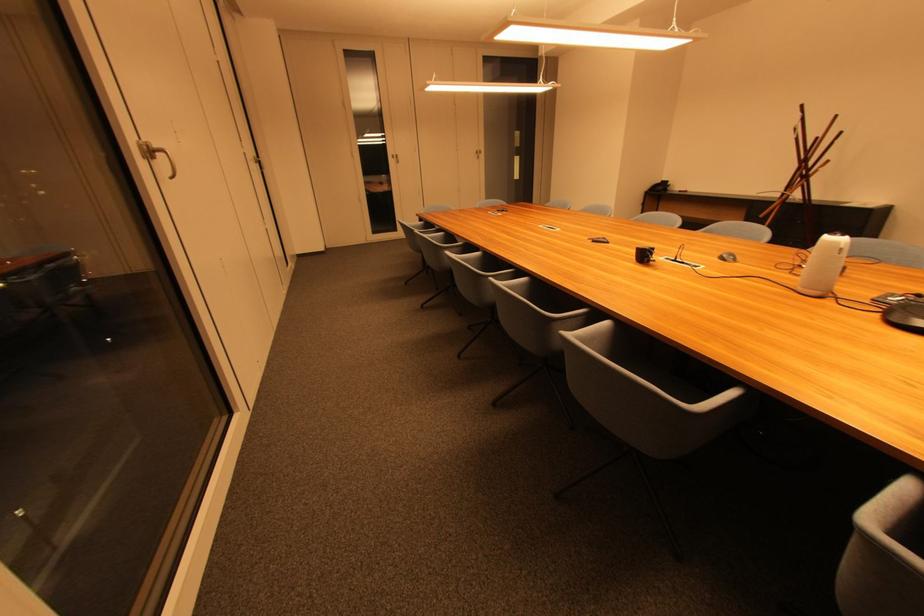
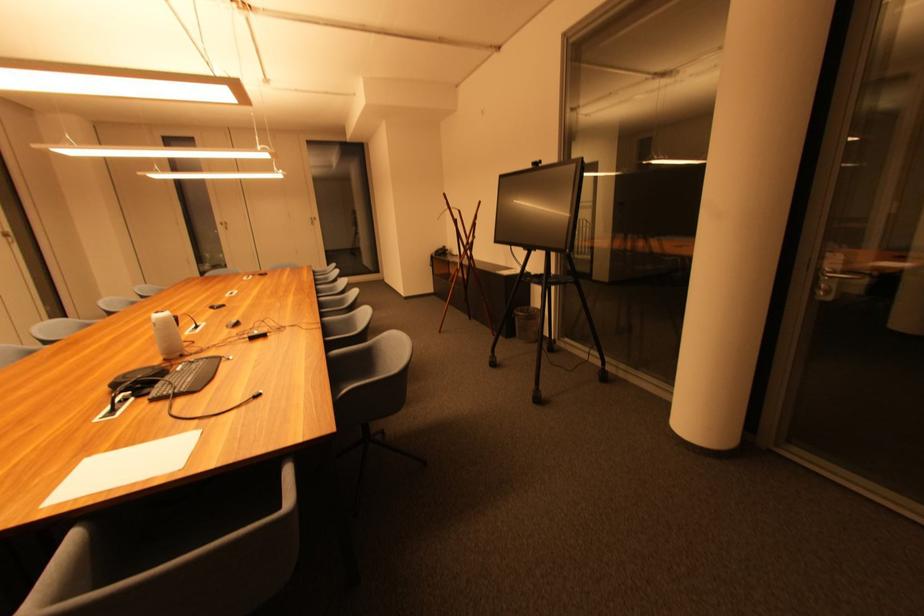
In the second image, find the point that corresponds to the point at 397,159 in the first image.

(226, 225)